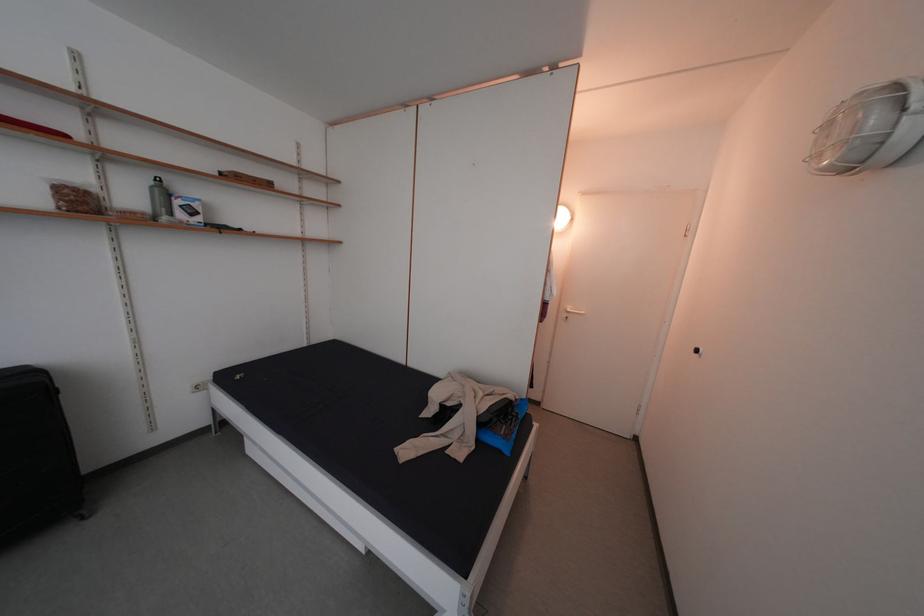
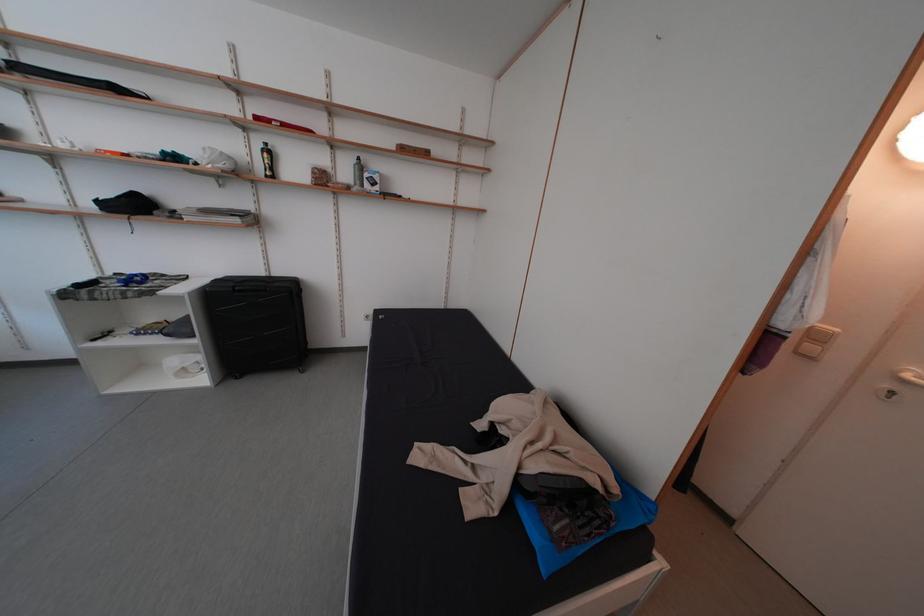
Question: Based on the continuous images, in which direction is the camera rotating? Reply with the corresponding letter.

Choices:
 (A) Left
 (B) Right
 (C) Up
 (D) Down

Answer: (A)